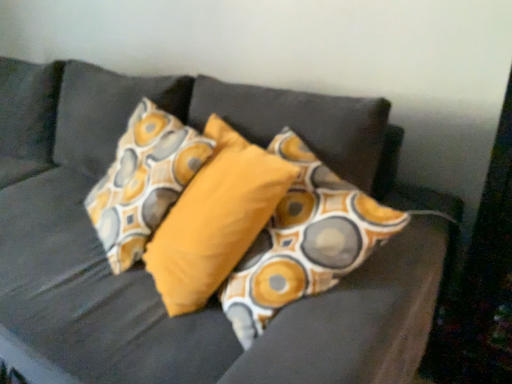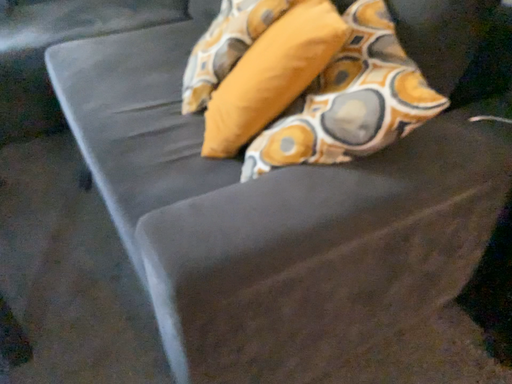
Question: Which way did the camera rotate in the video?

Choices:
 (A) rotated upward
 (B) rotated downward

Answer: (B)